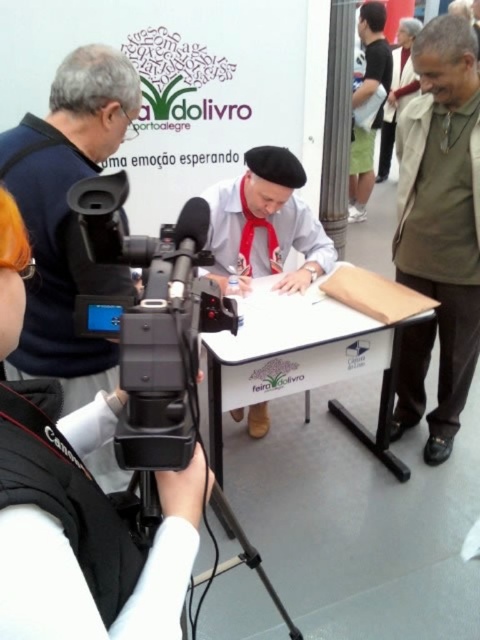
Question: Which object appears farthest from the camera in this image?

Choices:
 (A) matte black shirt at upper center
 (B) black plastic video camera at left
 (C) white paperboard table at center

Answer: (A)

Question: Does black plastic tripod at lower center appear on the right side of light beige fabric at upper right?

Choices:
 (A) yes
 (B) no

Answer: (B)

Question: Estimate the real-world distances between objects in this image. Which object is closer to the khaki cotton jacket at right?

Choices:
 (A) matte black shirt at upper center
 (B) light beige fabric at upper right

Answer: (A)

Question: Is white fabric camera at left positioned in front of white paperboard table at center?

Choices:
 (A) no
 (B) yes

Answer: (B)

Question: Which object is farther from the camera taking this photo?

Choices:
 (A) white paperboard table at center
 (B) white fabric camera at left
 (C) black plastic tripod at lower center
 (D) light beige fabric at upper right

Answer: (D)

Question: In this image, where is khaki cotton jacket at right located relative to black plastic tripod at lower center?

Choices:
 (A) below
 (B) above

Answer: (B)